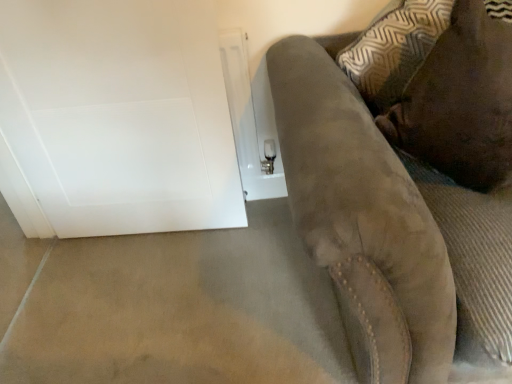
Image resolution: width=512 pixels, height=384 pixels. I want to click on vacant area that is situated to the right of white glossy door at left, so click(x=247, y=254).